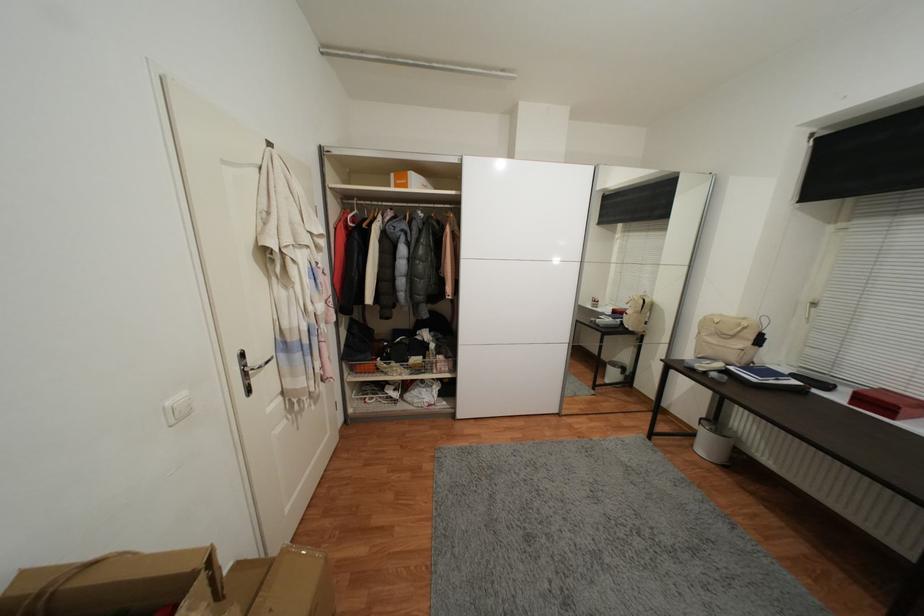
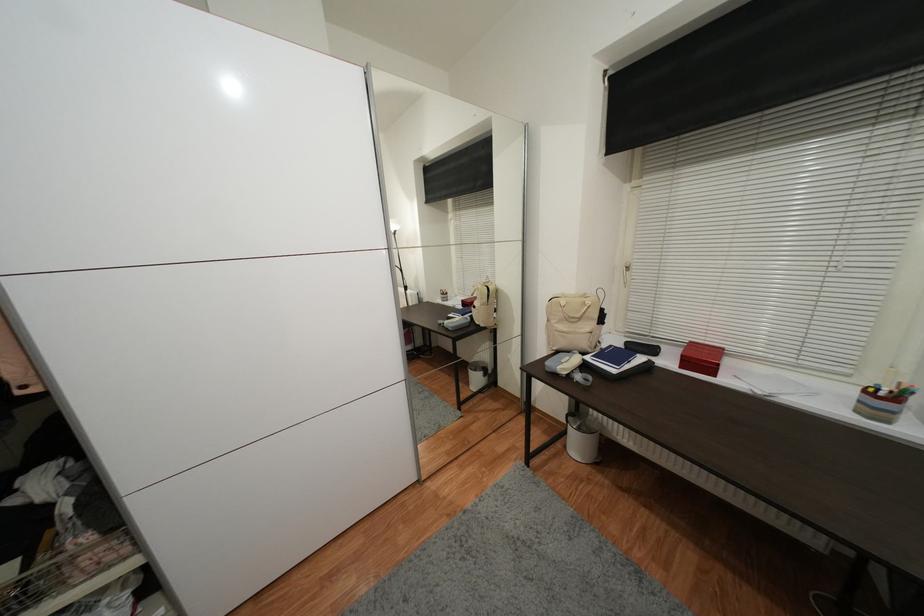
Find the pixel in the second image that matches (744,326) in the first image.

(589, 305)